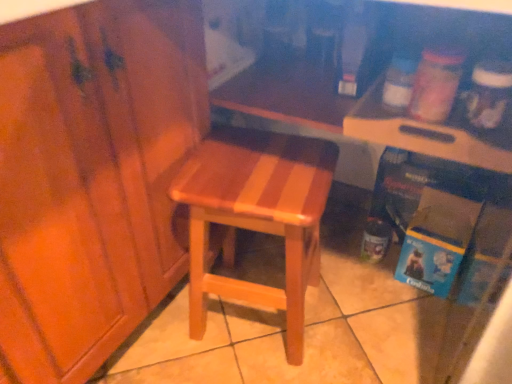
Describe the element at coordinates (257, 215) in the screenshot. I see `wooden stool at center` at that location.

Find the location of a particular element. The image size is (512, 384). wooden stool at center is located at coordinates (257, 215).

Measure the distance between point [294,166] and camera.

They are 34.76 inches apart.

This screenshot has height=384, width=512. What are the coordinates of `wooden stool at center` in the screenshot? It's located at (257, 215).